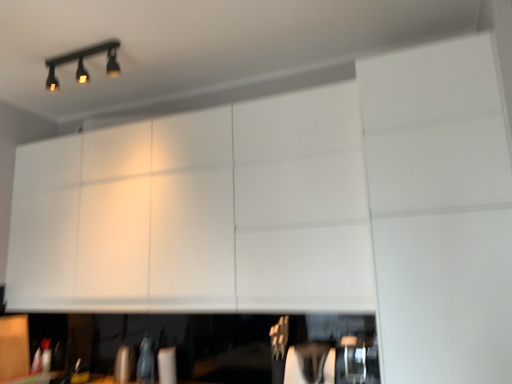
In order to face black matte track light at upper left, should I rotate leftwards or rightwards?

You should rotate left by 22.042 degrees.

Describe the element at coordinates (14, 346) in the screenshot. I see `matte wood cabinet at lower left, which is the 1th cabinetry in left-to-right order` at that location.

How much space does white matte cabinet at upper center, positioned as the first cabinetry in top-to-bottom order, occupy horizontally?

white matte cabinet at upper center, positioned as the first cabinetry in top-to-bottom order, is 26.33 inches in width.

At what (x,y) coordinates should I click in order to perform the action: click on black matte track light at upper left. Please return your answer as a coordinate pair (x, y). Looking at the image, I should click on (83, 64).

Is matte wood cabinet at lower left, which ranks as the 2th cabinetry in top-to-bottom order, turned away from white matte cabinet at upper center, the second cabinetry when ordered from bottom to top?

No, white matte cabinet at upper center, the second cabinetry when ordered from bottom to top, is not at the back of matte wood cabinet at lower left, which ranks as the 2th cabinetry in top-to-bottom order.

Which object is positioned more to the left, matte wood cabinet at lower left, which is counted as the first cabinetry, starting from the bottom, or white matte cabinet at upper center, which is the 1th cabinetry in right-to-left order?

matte wood cabinet at lower left, which is counted as the first cabinetry, starting from the bottom.

Which object is thinner, matte wood cabinet at lower left, which is counted as the first cabinetry, starting from the bottom, or white matte cabinet at upper center, which is the 1th cabinetry in right-to-left order?

matte wood cabinet at lower left, which is counted as the first cabinetry, starting from the bottom.

Is matte wood cabinet at lower left, which ranks as the 2th cabinetry in top-to-bottom order, far away from white matte cabinet at upper center, positioned as the first cabinetry in top-to-bottom order?

Yes.

From the image's perspective, does matte wood cabinet at lower left, acting as the 2th cabinetry starting from the right, appear lower than black matte track light at upper left?

Yes, from the image's perspective, matte wood cabinet at lower left, acting as the 2th cabinetry starting from the right, is below black matte track light at upper left.

Does matte wood cabinet at lower left, acting as the 2th cabinetry starting from the right, come behind black matte track light at upper left?

Yes, it is.

Is matte wood cabinet at lower left, which is counted as the first cabinetry, starting from the bottom, facing towards black matte track light at upper left?

No, matte wood cabinet at lower left, which is counted as the first cabinetry, starting from the bottom, is not aimed at black matte track light at upper left.

Is matte wood cabinet at lower left, which is counted as the first cabinetry, starting from the bottom, to the right of black matte track light at upper left from the viewer's perspective?

No.

You are a GUI agent. You are given a task and a screenshot of the screen. Output one action in this format:
    pyautogui.click(x=<x>, y=<y>)
    Task: Click on the lamp behind the white matte cabinet at upper center, the second cabinetry when ordered from bottom to top
    
    Given the screenshot: What is the action you would take?
    [83, 64]

Is white matte cabinet at upper center, which is the 1th cabinetry in right-to-left order, bigger than black matte track light at upper left?

Yes, white matte cabinet at upper center, which is the 1th cabinetry in right-to-left order, is bigger than black matte track light at upper left.

Based on the photo, does white matte cabinet at upper center, which is the 1th cabinetry in right-to-left order, come in front of black matte track light at upper left?

Yes, white matte cabinet at upper center, which is the 1th cabinetry in right-to-left order, is in front of black matte track light at upper left.

Is white matte cabinet at upper center, which is the 1th cabinetry in right-to-left order, not close to black matte track light at upper left?

That's right, there is a large distance between white matte cabinet at upper center, which is the 1th cabinetry in right-to-left order, and black matte track light at upper left.

In the scene shown: Can white matte cabinet at upper center, the second cabinetry in the left-to-right sequence, be found inside black matte track light at upper left?

No, white matte cabinet at upper center, the second cabinetry in the left-to-right sequence, is located outside of black matte track light at upper left.

In terms of height, does black matte track light at upper left look taller or shorter compared to white matte cabinet at upper center, the second cabinetry when ordered from bottom to top?

black matte track light at upper left is shorter than white matte cabinet at upper center, the second cabinetry when ordered from bottom to top.

From a real-world perspective, who is located higher, black matte track light at upper left or white matte cabinet at upper center, which is the 1th cabinetry in right-to-left order?

black matte track light at upper left.

Looking at this image, relative to matte wood cabinet at lower left, which ranks as the 2th cabinetry in top-to-bottom order, is black matte track light at upper left in front or behind?

Visually, black matte track light at upper left is located in front of matte wood cabinet at lower left, which ranks as the 2th cabinetry in top-to-bottom order.

Is black matte track light at upper left smaller than matte wood cabinet at lower left, which is counted as the first cabinetry, starting from the bottom?

Actually, black matte track light at upper left might be larger than matte wood cabinet at lower left, which is counted as the first cabinetry, starting from the bottom.

From the image's perspective, is black matte track light at upper left located above matte wood cabinet at lower left, which ranks as the 2th cabinetry in top-to-bottom order?

Yes, from the image's perspective, black matte track light at upper left is over matte wood cabinet at lower left, which ranks as the 2th cabinetry in top-to-bottom order.

Consider the image. From the image's perspective, which is above, white matte cabinet at upper center, positioned as the first cabinetry in top-to-bottom order, or matte wood cabinet at lower left, which ranks as the 2th cabinetry in top-to-bottom order?

white matte cabinet at upper center, positioned as the first cabinetry in top-to-bottom order, from the image's perspective.

Does white matte cabinet at upper center, positioned as the first cabinetry in top-to-bottom order, have a smaller size compared to matte wood cabinet at lower left, which ranks as the 2th cabinetry in top-to-bottom order?

No.

Is point (324, 181) closer or farther from the camera than point (8, 366)?

Point (324, 181) is closer to the camera than point (8, 366).

From the picture: Which object is closer to the camera taking this photo, white matte cabinet at upper center, which is the 1th cabinetry in right-to-left order, or matte wood cabinet at lower left, which ranks as the 2th cabinetry in top-to-bottom order?

Positioned in front is white matte cabinet at upper center, which is the 1th cabinetry in right-to-left order.

You are a GUI agent. You are given a task and a screenshot of the screen. Output one action in this format:
    pyautogui.click(x=<x>, y=<y>)
    Task: Click on the cabinetry on the right of the matte wood cabinet at lower left, which ranks as the 2th cabinetry in top-to-bottom order
    This screenshot has width=512, height=384.
    Given the screenshot: What is the action you would take?
    pyautogui.click(x=199, y=212)

At what (x,y) coordinates should I click in order to perform the action: click on cabinetry that is the 2nd one when counting downward from the black matte track light at upper left (from the image's perspective). Please return your answer as a coordinate pair (x, y). The height and width of the screenshot is (384, 512). Looking at the image, I should click on (14, 346).

Which object lies further to the anchor point white matte cabinet at upper center, positioned as the first cabinetry in top-to-bottom order, black matte track light at upper left or matte wood cabinet at lower left, acting as the 2th cabinetry starting from the right?

matte wood cabinet at lower left, acting as the 2th cabinetry starting from the right, is further to white matte cabinet at upper center, positioned as the first cabinetry in top-to-bottom order.

Based on their spatial positions, is matte wood cabinet at lower left, acting as the 2th cabinetry starting from the right, or white matte cabinet at upper center, which is the 1th cabinetry in right-to-left order, further from black matte track light at upper left?

matte wood cabinet at lower left, acting as the 2th cabinetry starting from the right.

Looking at this image, when comparing their distances from black matte track light at upper left, does white matte cabinet at upper center, positioned as the first cabinetry in top-to-bottom order, or matte wood cabinet at lower left, which ranks as the 2th cabinetry in top-to-bottom order, seem closer?

Among the two, white matte cabinet at upper center, positioned as the first cabinetry in top-to-bottom order, is located nearer to black matte track light at upper left.

Based on the photo, which object lies further to the anchor point matte wood cabinet at lower left, which is counted as the first cabinetry, starting from the bottom, black matte track light at upper left or white matte cabinet at upper center, the second cabinetry in the left-to-right sequence?

black matte track light at upper left is further to matte wood cabinet at lower left, which is counted as the first cabinetry, starting from the bottom.

From the image, which object appears to be farther from matte wood cabinet at lower left, which is the 1th cabinetry in left-to-right order, white matte cabinet at upper center, positioned as the first cabinetry in top-to-bottom order, or black matte track light at upper left?

black matte track light at upper left is positioned further to the anchor matte wood cabinet at lower left, which is the 1th cabinetry in left-to-right order.

From the image, which object appears to be nearer to white matte cabinet at upper center, the second cabinetry in the left-to-right sequence, matte wood cabinet at lower left, which ranks as the 2th cabinetry in top-to-bottom order, or black matte track light at upper left?

black matte track light at upper left.

Locate an element on the screen. cabinetry that lies between black matte track light at upper left and matte wood cabinet at lower left, which ranks as the 2th cabinetry in top-to-bottom order, from top to bottom is located at coordinates (199, 212).